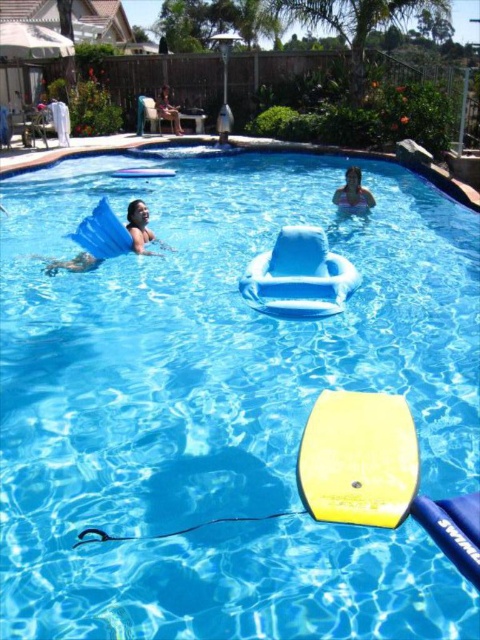
Who is shorter, yellow foam paddle at center or matte blue floatie at upper left?

With less height is yellow foam paddle at center.

Is yellow foam paddle at center above matte blue floatie at upper left?

Actually, yellow foam paddle at center is below matte blue floatie at upper left.

Locate an element on the screen. yellow foam paddle at center is located at coordinates (379, 474).

Identify the location of yellow foam paddle at center. This screenshot has height=640, width=480. (379, 474).

Image resolution: width=480 pixels, height=640 pixels. What do you see at coordinates (108, 237) in the screenshot? I see `blue rubber mermaid tail at upper left` at bounding box center [108, 237].

Is point (134, 221) less distant than point (336, 193)?

Yes.

The image size is (480, 640). Find the location of `blue rubber mermaid tail at upper left`. blue rubber mermaid tail at upper left is located at coordinates (108, 237).

Can you confirm if blue rubber mermaid tail at upper left is taller than matte blue floatie at upper left?

In fact, blue rubber mermaid tail at upper left may be shorter than matte blue floatie at upper left.

From the picture: Between blue rubber mermaid tail at upper left and matte blue floatie at upper left, which one has less height?

Standing shorter between the two is blue rubber mermaid tail at upper left.

Which is in front, point (118, 248) or point (159, 92)?

Point (118, 248)

The image size is (480, 640). In order to click on blue rubber mermaid tail at upper left in this screenshot , I will do `click(108, 237)`.